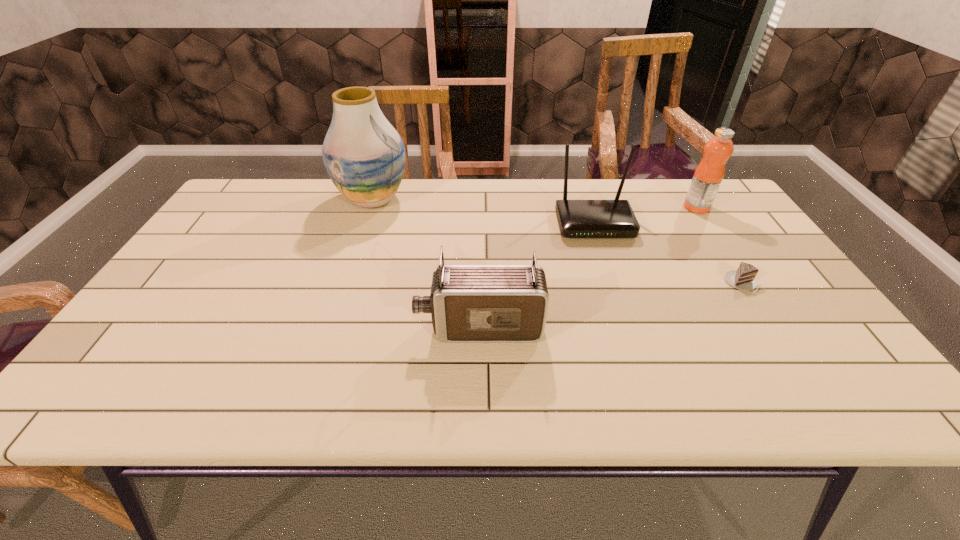
Locate an element on the screen. vase is located at coordinates (364, 156).

At what (x,y) coordinates should I click in order to perform the action: click on the tallest object. Please return your answer as a coordinate pair (x, y). Looking at the image, I should click on (364, 156).

The height and width of the screenshot is (540, 960). I want to click on fruit juice, so click(709, 174).

At what (x,y) coordinates should I click in order to perform the action: click on router. Please return your answer as a coordinate pair (x, y). The image size is (960, 540). Looking at the image, I should click on (615, 218).

Where is `the nearest object`? the nearest object is located at coordinates (468, 302).

You are a GUI agent. You are given a task and a screenshot of the screen. Output one action in this format:
    pyautogui.click(x=<x>, y=<y>)
    Task: Click on the camcorder
    The width and height of the screenshot is (960, 540).
    Given the screenshot: What is the action you would take?
    click(x=468, y=302)

Where is `the second nearest object`? Image resolution: width=960 pixels, height=540 pixels. the second nearest object is located at coordinates (744, 278).

The width and height of the screenshot is (960, 540). What are the coordinates of `the shortest object` in the screenshot? It's located at (744, 278).

You are a GUI agent. You are given a task and a screenshot of the screen. Output one action in this format:
    pyautogui.click(x=<x>, y=<y>)
    Task: Click on the free space located 0.220m on the right of the leftmost object
    Image resolution: width=960 pixels, height=540 pixels.
    Given the screenshot: What is the action you would take?
    pyautogui.click(x=480, y=199)

Image resolution: width=960 pixels, height=540 pixels. Identify the location of vacant area situated 0.340m on the front of the fruit juice. (753, 293).